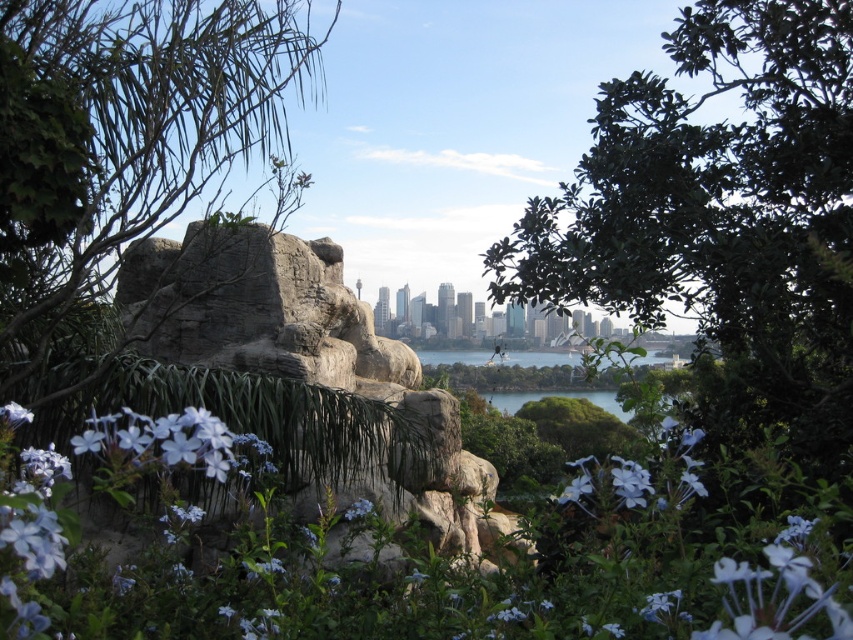
Question: Among these points, which one is farthest from the camera?

Choices:
 (A) (535, 396)
 (B) (357, 502)
 (C) (85, 212)

Answer: (A)

Question: Is green leafy tree at center thinner than matte purple flower at lower left?

Choices:
 (A) yes
 (B) no

Answer: (B)

Question: Can you confirm if matte purple flower at lower left is positioned to the right of matte white flower at lower left?

Choices:
 (A) no
 (B) yes

Answer: (B)

Question: Which of the following is the farthest from the observer?

Choices:
 (A) green leafy tree at left
 (B) green liquid water at center

Answer: (B)

Question: Is green liquid water at center below purple matte flower at center?

Choices:
 (A) no
 (B) yes

Answer: (B)

Question: Which object is positioned closest to the green leafy tree at center?

Choices:
 (A) matte purple flower at lower left
 (B) purple matte flower at center

Answer: (A)